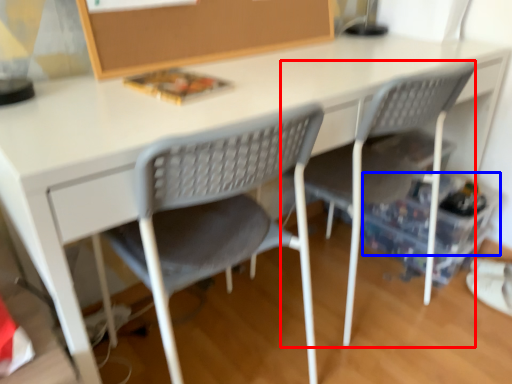
Question: Which point is further to the camera, chair (highlighted by a red box) or storage box (highlighted by a blue box)?

Choices:
 (A) chair
 (B) storage box

Answer: (B)